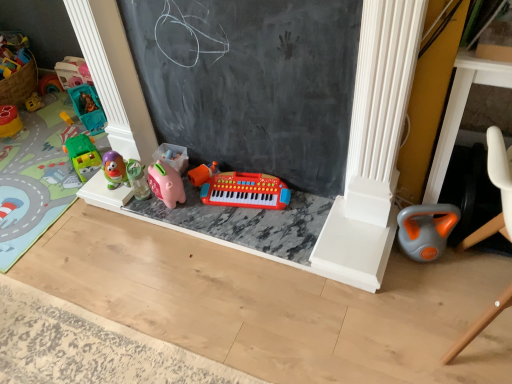
Question: From a real-world perspective, is rubberized green car at left, which ranks as the first toy in left-to-right order, over black chalkboard at center?

Choices:
 (A) no
 (B) yes

Answer: (A)

Question: Considering the relative positions of rubberized green car at left, which ranks as the first toy in left-to-right order, and black chalkboard at center in the image provided, is rubberized green car at left, which ranks as the first toy in left-to-right order, behind black chalkboard at center?

Choices:
 (A) yes
 (B) no

Answer: (A)

Question: Is black chalkboard at center a part of rubberized green car at left, which is counted as the 7th toy, starting from the right?

Choices:
 (A) yes
 (B) no

Answer: (B)

Question: Is rubberized green car at left, which is counted as the 7th toy, starting from the right, bigger than black chalkboard at center?

Choices:
 (A) no
 (B) yes

Answer: (A)

Question: Would you consider rubberized green car at left, which ranks as the first toy in left-to-right order, to be distant from black chalkboard at center?

Choices:
 (A) yes
 (B) no

Answer: (A)

Question: From the image's perspective, is pink rubber piggy bank at center, which ranks as the fourth toy in left-to-right order, located above or below green plastic car at left, the 5th toy when ordered from right to left?

Choices:
 (A) above
 (B) below

Answer: (B)

Question: In the image, is pink rubber piggy bank at center, arranged as the 4th toy when viewed from the right, positioned in front of or behind green plastic car at left, the 5th toy when ordered from right to left?

Choices:
 (A) behind
 (B) front

Answer: (B)

Question: Is point (132, 190) positioned closer to the camera than point (90, 148)?

Choices:
 (A) closer
 (B) farther

Answer: (A)

Question: Considering the positions of pink rubber piggy bank at center, arranged as the 4th toy when viewed from the right, and green plastic car at left, the 5th toy when ordered from right to left, in the image, is pink rubber piggy bank at center, arranged as the 4th toy when viewed from the right, wider or thinner than green plastic car at left, the 5th toy when ordered from right to left,?

Choices:
 (A) wide
 (B) thin

Answer: (B)

Question: Looking at their shapes, would you say pink rubber piggy bank at center, which is the 5th toy from left to right, is wider or thinner than green plastic car at left, marked as the third toy in a left-to-right arrangement?

Choices:
 (A) thin
 (B) wide

Answer: (A)

Question: Is point (164, 168) closer or farther from the camera than point (81, 167)?

Choices:
 (A) farther
 (B) closer

Answer: (B)

Question: Is pink rubber piggy bank at center, acting as the 3th toy starting from the right, inside the boundaries of green plastic car at left, the 5th toy when ordered from right to left, or outside?

Choices:
 (A) outside
 (B) inside

Answer: (A)

Question: From a real-world perspective, is pink rubber piggy bank at center, which is the 5th toy from left to right, physically located above or below green plastic car at left, marked as the third toy in a left-to-right arrangement?

Choices:
 (A) below
 (B) above

Answer: (B)

Question: Relative to pink rubber piggy bank at center, which ranks as the fourth toy in left-to-right order, is rubberized green car at left, which ranks as the first toy in left-to-right order, in front or behind?

Choices:
 (A) behind
 (B) front

Answer: (A)

Question: Based on their sizes in the image, would you say rubberized green car at left, which ranks as the first toy in left-to-right order, is bigger or smaller than pink rubber piggy bank at center, which ranks as the fourth toy in left-to-right order?

Choices:
 (A) small
 (B) big

Answer: (B)